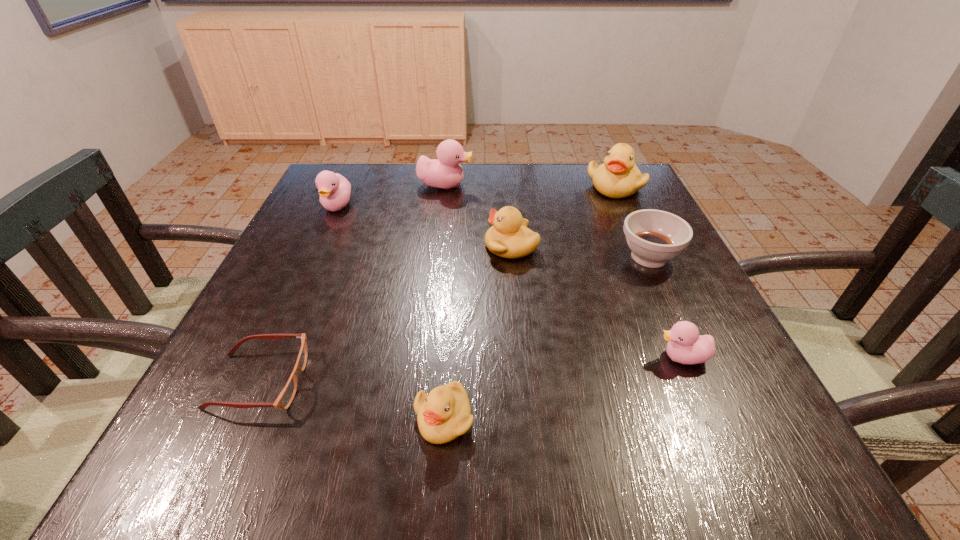
Where is `free area in between the third nearest duckling and the smallest yellow duckling`? free area in between the third nearest duckling and the smallest yellow duckling is located at coordinates (478, 332).

Find the location of a particular element. free point between the farthest pink duckling and the farthest yellow duckling is located at coordinates (530, 185).

Identify the location of vacant area that lies between the second pink duckling from right to left and the second farthest pink duckling. Image resolution: width=960 pixels, height=540 pixels. (391, 195).

At what (x,y) coordinates should I click in order to perform the action: click on vacant area between the fourth farthest duckling and the biggest yellow duckling. Please return your answer as a coordinate pair (x, y). The height and width of the screenshot is (540, 960). Looking at the image, I should click on (563, 216).

The image size is (960, 540). I want to click on unoccupied area between the fifth farthest duckling and the soup bowl, so click(665, 307).

Identify the location of free space between the nearest duckling and the soup bowl. Image resolution: width=960 pixels, height=540 pixels. click(546, 338).

At what (x,y) coordinates should I click in order to perform the action: click on free space between the second pink duckling from right to left and the spectacles. Please return your answer as a coordinate pair (x, y). This screenshot has width=960, height=540. Looking at the image, I should click on (352, 283).

At what (x,y) coordinates should I click in order to perform the action: click on unoccupied position between the leftmost pink duckling and the biggest yellow duckling. Please return your answer as a coordinate pair (x, y). This screenshot has width=960, height=540. Looking at the image, I should click on (476, 196).

This screenshot has width=960, height=540. I want to click on object that stands as the fifth closest to the biggest pink duckling, so pos(286,396).

Identify which object is the second nearest to the soup bowl. Please provide its 2D coordinates. Your answer should be formatted as a tuple, i.e. [(x, y)], where the tuple contains the x and y coordinates of a point satisfying the conditions above.

[(509, 237)]